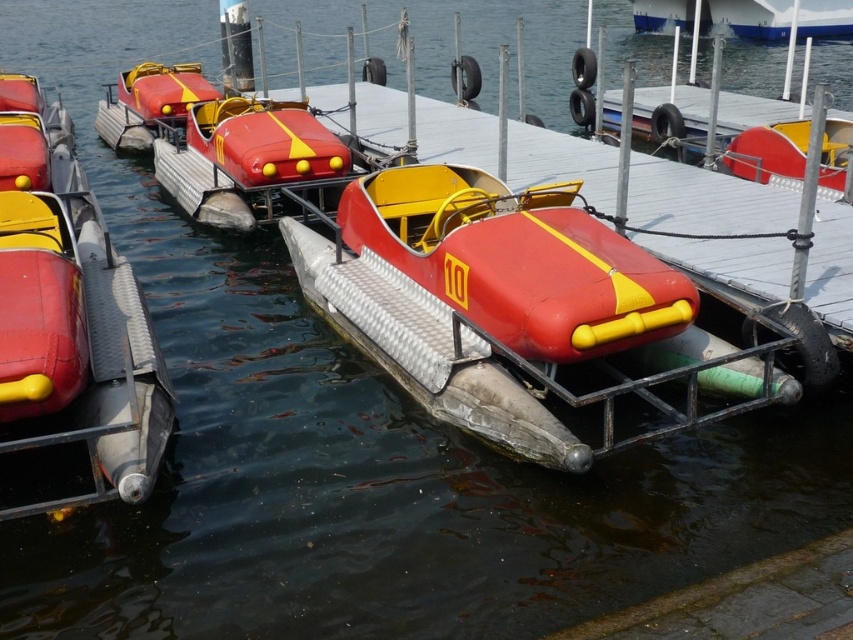
You are planning to take a photo of the metallic dock at center and the matte red and yellow pedal boat at center. Which object should you focus on if you want to capture the larger subject in your frame?

The matte red and yellow pedal boat at center should be focused on because it occupies more space than the metallic dock at center.